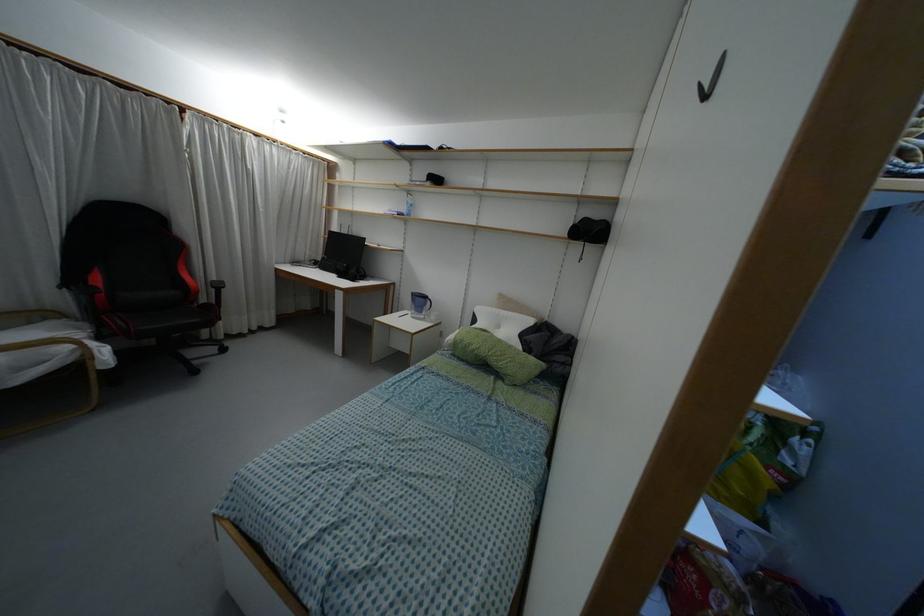
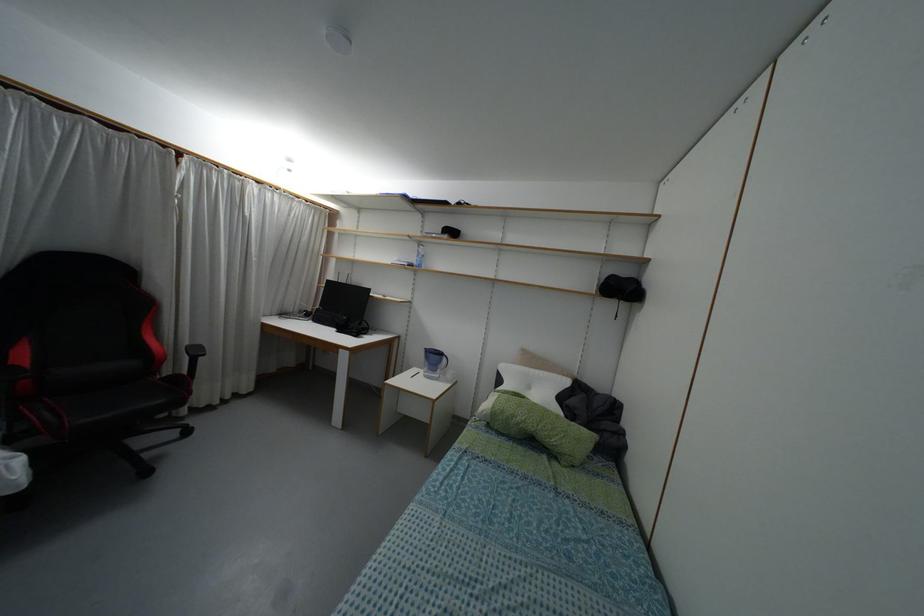
Question: The images are taken continuously from a first-person perspective. In which direction is your viewpoint rotating?

Choices:
 (A) Left
 (B) Right
 (C) Up
 (D) Down

Answer: (C)